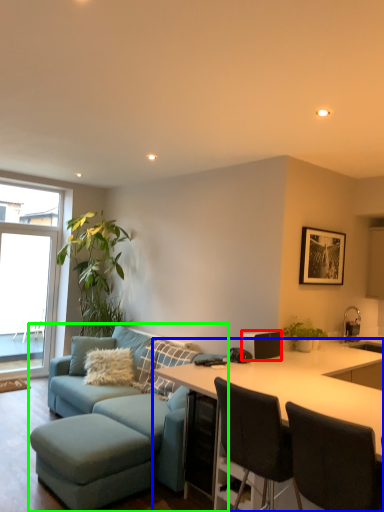
Question: Based on their relative distances, which object is nearer to appliance (highlighted by a red box)? Choose from desk (highlighted by a blue box) and studio couch (highlighted by a green box).

Choices:
 (A) desk
 (B) studio couch

Answer: (A)